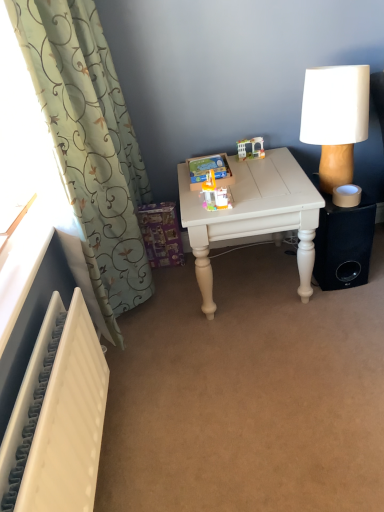
Locate an element on the screen. This screenshot has height=512, width=384. vacant area that lies in front of white painted wood table at center is located at coordinates (267, 356).